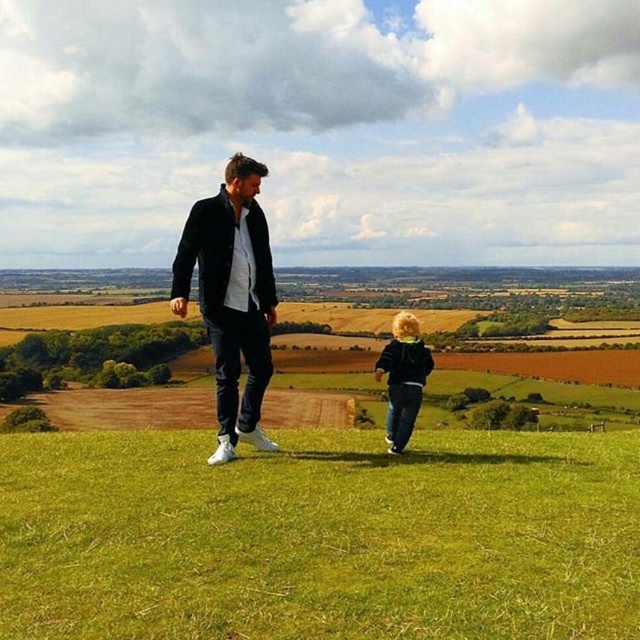
Is green grass at center wider than matte black hoodie at center?

Indeed, green grass at center has a greater width compared to matte black hoodie at center.

Is green grass at center to the right of matte black hoodie at center from the viewer's perspective?

In fact, green grass at center is to the left of matte black hoodie at center.

You are a GUI agent. You are given a task and a screenshot of the screen. Output one action in this format:
    pyautogui.click(x=<x>, y=<y>)
    Task: Click on the green grass at center
    Image resolution: width=640 pixels, height=640 pixels.
    Given the screenshot: What is the action you would take?
    pyautogui.click(x=320, y=538)

The width and height of the screenshot is (640, 640). Describe the element at coordinates (320, 538) in the screenshot. I see `green grass at center` at that location.

Is green grass at center in front of black matte jacket at center?

That is True.

Identify the location of green grass at center. (320, 538).

Is black matte jacket at center thinner than matte black hoodie at center?

Indeed, black matte jacket at center has a lesser width compared to matte black hoodie at center.

The width and height of the screenshot is (640, 640). What are the coordinates of `black matte jacket at center` in the screenshot? It's located at tap(230, 298).